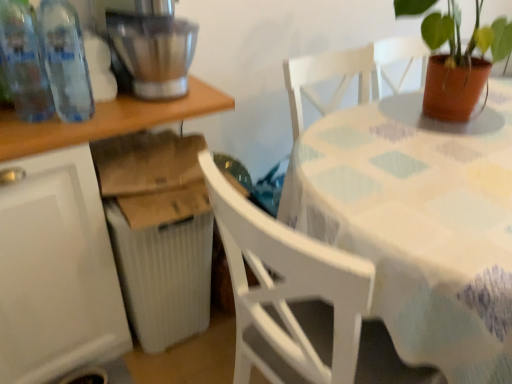
Identify the location of space that is in front of terracotta pot at table. The image size is (512, 384). (467, 157).